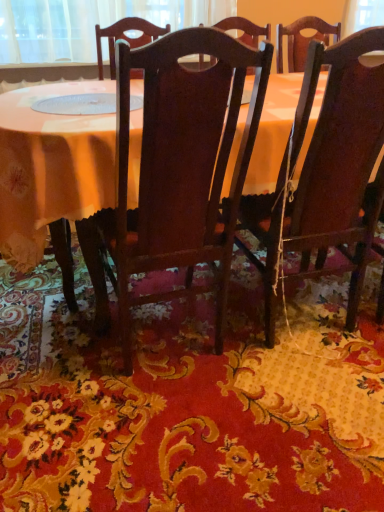
Question: Is wooden table at center outside of dark wood chair at center, the 2th chair from the right?

Choices:
 (A) no
 (B) yes

Answer: (B)

Question: From a real-world perspective, is wooden table at center physically below dark wood chair at center, the 2th chair from the right?

Choices:
 (A) yes
 (B) no

Answer: (A)

Question: Does wooden table at center have a lesser width compared to dark wood chair at center, the 2th chair from the right?

Choices:
 (A) no
 (B) yes

Answer: (A)

Question: Can you confirm if wooden table at center is shorter than dark wood chair at center, the first chair positioned from the left?

Choices:
 (A) yes
 (B) no

Answer: (A)

Question: Is wooden table at center surrounding dark wood chair at center, the 2th chair from the right?

Choices:
 (A) yes
 (B) no

Answer: (A)

Question: Considering the positions of dark wood chair at center, the first chair positioned from the left, and floral carpet at center in the image, is dark wood chair at center, the first chair positioned from the left, bigger or smaller than floral carpet at center?

Choices:
 (A) small
 (B) big

Answer: (B)

Question: Would you say dark wood chair at center, the 2th chair from the right, is to the left or to the right of floral carpet at center in the picture?

Choices:
 (A) left
 (B) right

Answer: (A)

Question: Looking at their shapes, would you say dark wood chair at center, the 2th chair from the right, is wider or thinner than floral carpet at center?

Choices:
 (A) wide
 (B) thin

Answer: (B)

Question: From a real-world perspective, is dark wood chair at center, the first chair positioned from the left, physically located above or below floral carpet at center?

Choices:
 (A) above
 (B) below

Answer: (A)

Question: Is floral carpet at center to the left or to the right of wooden table at center in the image?

Choices:
 (A) right
 (B) left

Answer: (B)

Question: From the image's perspective, is floral carpet at center located above or below wooden table at center?

Choices:
 (A) above
 (B) below

Answer: (B)

Question: Considering the positions of floral carpet at center and wooden table at center in the image, is floral carpet at center bigger or smaller than wooden table at center?

Choices:
 (A) big
 (B) small

Answer: (B)

Question: In terms of width, does floral carpet at center look wider or thinner when compared to wooden table at center?

Choices:
 (A) thin
 (B) wide

Answer: (B)

Question: In the image, is floral carpet at center on the left side or the right side of dark wood chair at right, placed as the 2th chair when sorted from left to right?

Choices:
 (A) left
 (B) right

Answer: (A)

Question: Considering the positions of floral carpet at center and dark wood chair at right, placed as the first chair when sorted from right to left, in the image, is floral carpet at center bigger or smaller than dark wood chair at right, placed as the first chair when sorted from right to left,?

Choices:
 (A) small
 (B) big

Answer: (A)